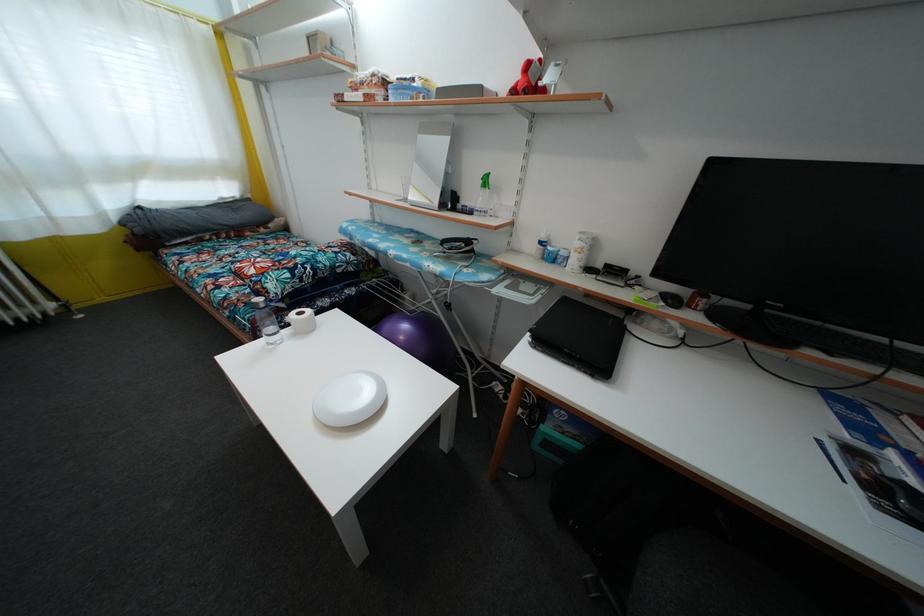
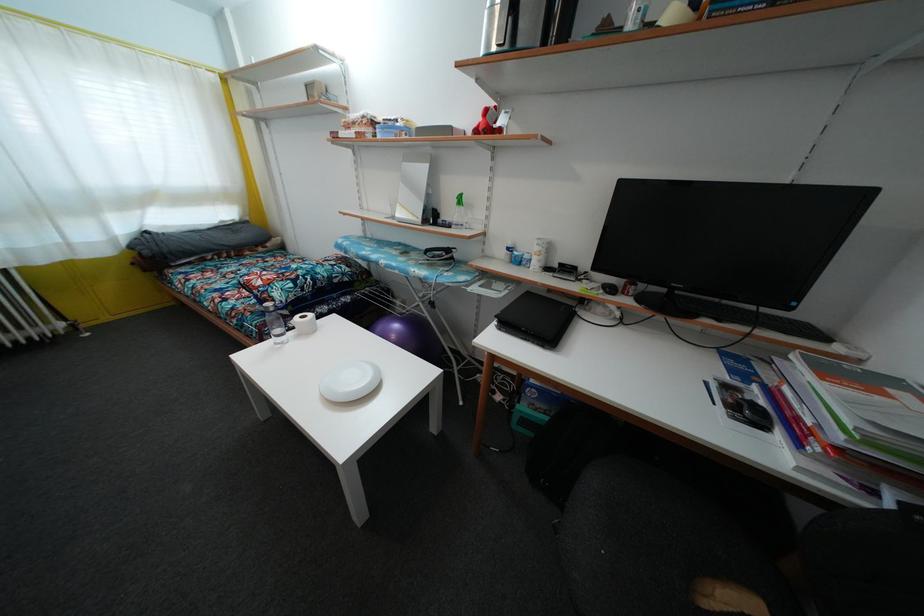
Where in the second image is the point corresponding to (422,310) from the first image?

(411, 315)